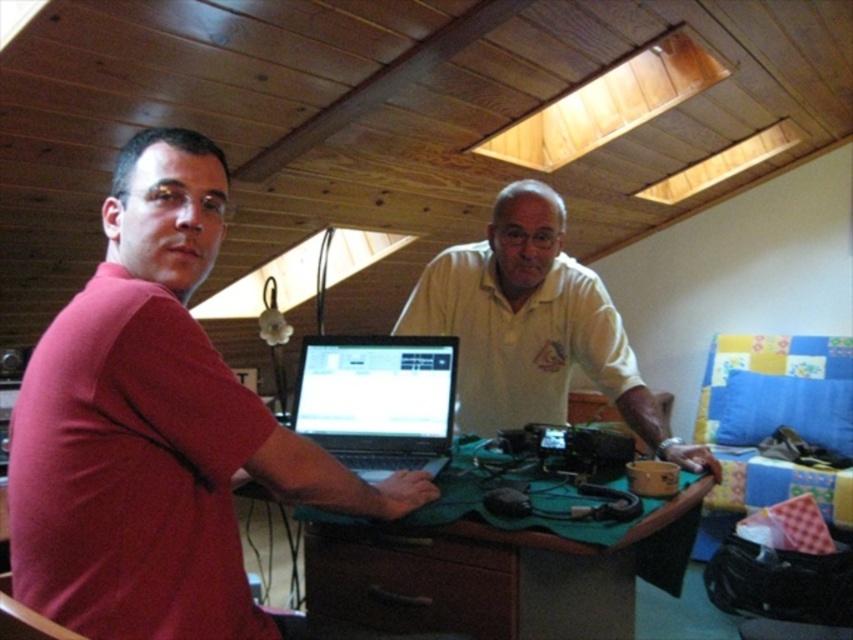
Question: Where is green felt at center located in relation to matte black laptop at center in the image?

Choices:
 (A) below
 (B) above

Answer: (A)

Question: Among these points, which one is nearest to the camera?

Choices:
 (A) (409, 460)
 (B) (621, 483)
 (C) (541, 253)
 (D) (380, 499)

Answer: (D)

Question: Is green felt at center above matte black laptop at center?

Choices:
 (A) no
 (B) yes

Answer: (A)

Question: Which object appears closest to the camera in this image?

Choices:
 (A) white matte shirt at center
 (B) matte black laptop at center
 (C) matte red shirt at center
 (D) green felt at center

Answer: (C)

Question: Which point is farther from the camera taking this photo?

Choices:
 (A) (521, 390)
 (B) (404, 554)
 (C) (194, 250)
 (D) (309, 349)

Answer: (A)

Question: Does matte red shirt at center have a greater width compared to white matte shirt at center?

Choices:
 (A) yes
 (B) no

Answer: (B)